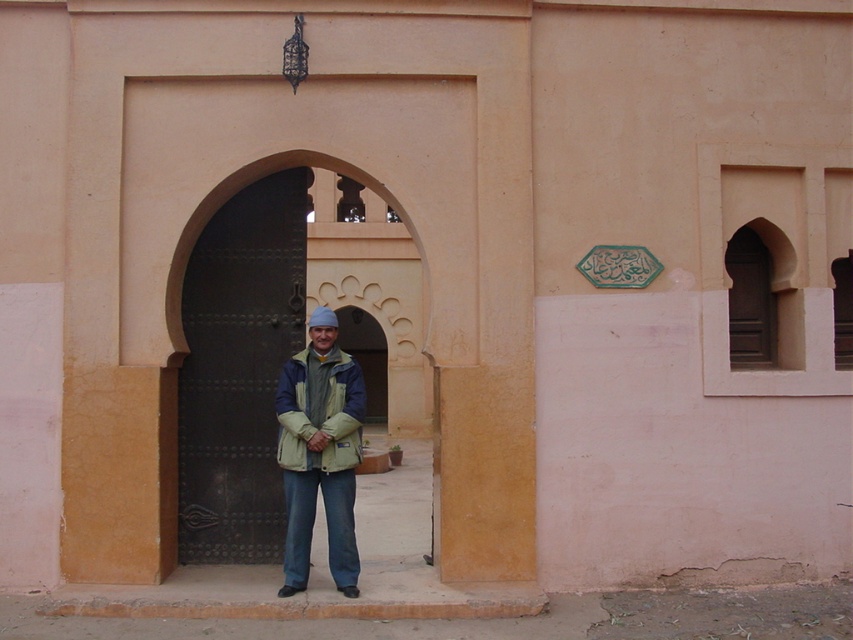
You are a photographer standing at the center of a room with a camera. You want to take a picture of the dark brown metal door at center. Where should you point your camera to capture it in the frame?

The dark brown metal door at center is located at coordinates 0.580 on the x axis and 0.281 on the y axis, so you should point your camera towards those coordinates to capture it in the frame.

What is located at the coordinates point [239,371] in the image?

The dark brown metal door at center is located at point [239,371].

You are a fashion designer observing two jackets in the image. The light green fabric jacket at center and the beige textured jacket at center. Which one is more to the left?

The light green fabric jacket at center is positioned on the left side of beige textured jacket at center, so it is more to the left.